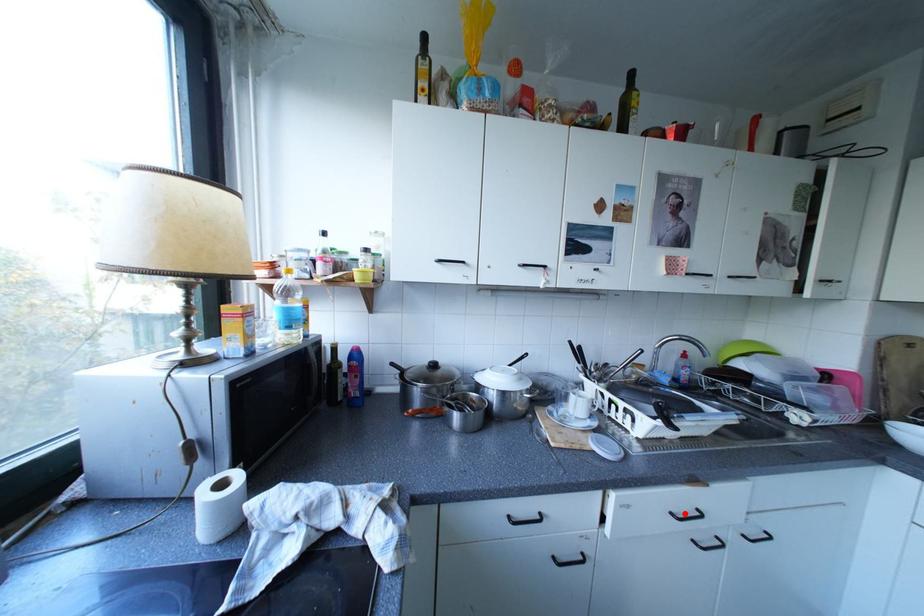
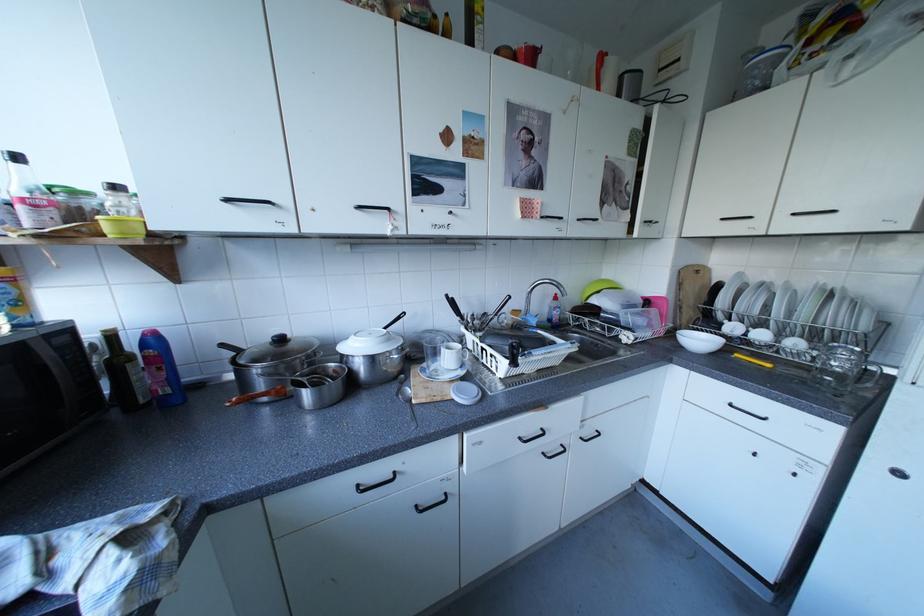
Question: I am providing you with two images of the same scene from different viewpoints. Given a red point in image1, look at the same physical point in image2. Is it:

Choices:
 (A) Closer to the viewpoint
 (B) Farther from the viewpoint

Answer: (B)